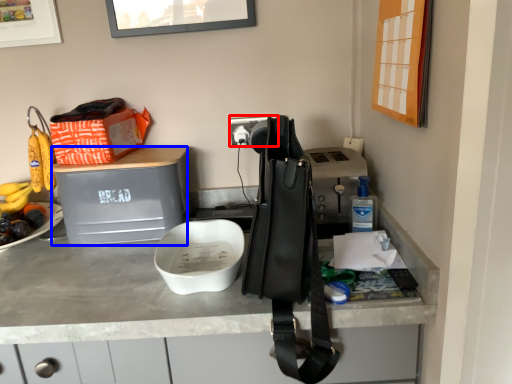
Question: Which object appears closest to the camera in this image, power outlet (highlighted by a red box) or wide (highlighted by a blue box)?

Choices:
 (A) power outlet
 (B) wide

Answer: (B)